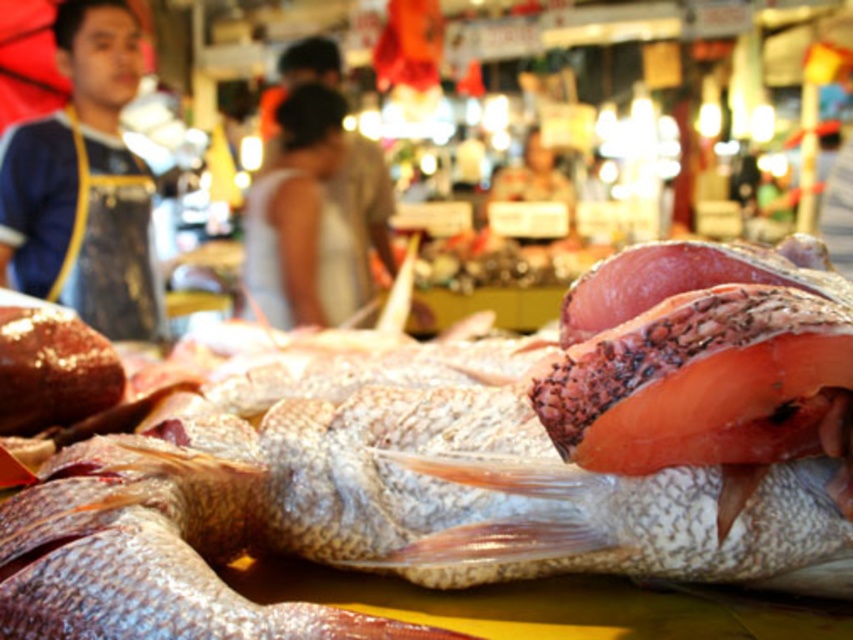
Question: Which point is farther from the camera taking this photo?

Choices:
 (A) (41, 163)
 (B) (334, 237)

Answer: (B)

Question: Can you confirm if blue apron at left is thinner than white fabric dress at center?

Choices:
 (A) no
 (B) yes

Answer: (B)

Question: Is blue apron at left wider than white fabric dress at center?

Choices:
 (A) yes
 (B) no

Answer: (B)

Question: Does blue apron at left appear over white fabric dress at center?

Choices:
 (A) yes
 (B) no

Answer: (B)

Question: Which point appears closest to the camera in this image?

Choices:
 (A) (247, 200)
 (B) (152, 312)

Answer: (B)